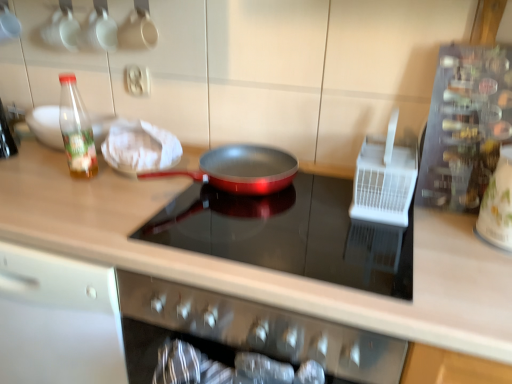
Image resolution: width=512 pixels, height=384 pixels. What do you see at coordinates (261, 268) in the screenshot?
I see `matte wood countertop at center` at bounding box center [261, 268].

Measure the distance between point (454, 264) and camera.

Point (454, 264) and camera are 34.57 inches apart from each other.

Identify the location of metallic silver spice rack at right, which ranks as the 2th appliance in right-to-left order. (465, 126).

At what (x,y) coordinates should I click in order to perform the action: click on transparent plastic bottle at left. Please return your answer as a coordinate pair (x, y). The height and width of the screenshot is (384, 512). Looking at the image, I should click on (76, 130).

Locate an element on the screen. countertop in front of the white glossy jar at right, arranged as the first appliance when viewed from the right is located at coordinates (261, 268).

Is matte wood countertop at center placed right next to white glossy jar at right, the 3th appliance positioned from the left?

No, matte wood countertop at center is not beside white glossy jar at right, the 3th appliance positioned from the left.

Is matte wood countertop at center turned away from white glossy jar at right, arranged as the first appliance when viewed from the right?

matte wood countertop at center does not have its back to white glossy jar at right, arranged as the first appliance when viewed from the right.

Based on the photo, is matte wood countertop at center far away from white cloth at upper left?

matte wood countertop at center is actually quite close to white cloth at upper left.

Considering the sizes of objects matte wood countertop at center and white cloth at upper left in the image provided, who is taller, matte wood countertop at center or white cloth at upper left?

Standing taller between the two is matte wood countertop at center.

Locate an element on the screen. Image resolution: width=512 pixels, height=384 pixels. food behind the matte wood countertop at center is located at coordinates (140, 147).

Which object is wider, matte wood countertop at center or white cloth at upper left?

With larger width is matte wood countertop at center.

Looking at their sizes, would you say metallic red frying pan at center is wider or thinner than metallic silver spice rack at right, which ranks as the 2th appliance in right-to-left order?

Considering their sizes, metallic red frying pan at center looks broader than metallic silver spice rack at right, which ranks as the 2th appliance in right-to-left order.

Can you confirm if metallic red frying pan at center is taller than metallic silver spice rack at right, which ranks as the 2th appliance in right-to-left order?

In fact, metallic red frying pan at center may be shorter than metallic silver spice rack at right, which ranks as the 2th appliance in right-to-left order.

From a real-world perspective, relative to metallic silver spice rack at right, which ranks as the 2th appliance in right-to-left order, is metallic red frying pan at center vertically above or below?

Clearly, from a real-world perspective, metallic red frying pan at center is below metallic silver spice rack at right, which ranks as the 2th appliance in right-to-left order.

Measure the distance from white plastic utensil holder at right, which is the 1th appliance from left to right, to matte wood countertop at center.

white plastic utensil holder at right, which is the 1th appliance from left to right, and matte wood countertop at center are 12.86 inches apart from each other.

Would you say matte wood countertop at center is part of white plastic utensil holder at right, which ranks as the third appliance in right-to-left order,'s contents?

Actually, matte wood countertop at center is outside white plastic utensil holder at right, which ranks as the third appliance in right-to-left order.

Is white plastic utensil holder at right, which ranks as the third appliance in right-to-left order, far away from matte wood countertop at center?

No, white plastic utensil holder at right, which ranks as the third appliance in right-to-left order, is not far from matte wood countertop at center.

From the image's perspective, which appliance is the 2nd one above the matte wood countertop at center? Please provide its 2D coordinates.

[(384, 179)]

Does metallic silver spice rack at right, placed as the second appliance when sorted from left to right, have a smaller size compared to white plastic utensil holder at right, which ranks as the third appliance in right-to-left order?

Actually, metallic silver spice rack at right, placed as the second appliance when sorted from left to right, might be larger than white plastic utensil holder at right, which ranks as the third appliance in right-to-left order.

From the image's perspective, between metallic silver spice rack at right, placed as the second appliance when sorted from left to right, and white plastic utensil holder at right, which ranks as the third appliance in right-to-left order, which one is located above?

metallic silver spice rack at right, placed as the second appliance when sorted from left to right, appears higher in the image.

How many degrees apart are the facing directions of metallic silver spice rack at right, which ranks as the 2th appliance in right-to-left order, and white plastic utensil holder at right, which ranks as the third appliance in right-to-left order?

There is a 0.254-degree angle between the facing directions of metallic silver spice rack at right, which ranks as the 2th appliance in right-to-left order, and white plastic utensil holder at right, which ranks as the third appliance in right-to-left order.

Which appliance is the 1st one when counting from the right side of the white plastic utensil holder at right, which ranks as the third appliance in right-to-left order? Please provide its 2D coordinates.

[(465, 126)]

What's the angular difference between white glossy jar at right, the 3th appliance positioned from the left, and white plastic utensil holder at right, which is the 1th appliance from left to right,'s facing directions?

The angle between the facing direction of white glossy jar at right, the 3th appliance positioned from the left, and the facing direction of white plastic utensil holder at right, which is the 1th appliance from left to right, is 1.7 degrees.

Between white glossy jar at right, the 3th appliance positioned from the left, and white plastic utensil holder at right, which is the 1th appliance from left to right, which one has larger size?

With larger size is white plastic utensil holder at right, which is the 1th appliance from left to right.

Which is behind, point (504, 240) or point (385, 156)?

Positioned behind is point (385, 156).

From a real-world perspective, which is physically below, white glossy jar at right, the 3th appliance positioned from the left, or white plastic utensil holder at right, which is the 1th appliance from left to right?

From a 3D spatial view, white glossy jar at right, the 3th appliance positioned from the left, is below.

In the scene shown: Does metallic silver spice rack at right, placed as the second appliance when sorted from left to right, have a lesser width compared to matte wood countertop at center?

Yes.

Does metallic silver spice rack at right, placed as the second appliance when sorted from left to right, appear on the left side of matte wood countertop at center?

In fact, metallic silver spice rack at right, placed as the second appliance when sorted from left to right, is to the right of matte wood countertop at center.

From a real-world perspective, is metallic silver spice rack at right, which ranks as the 2th appliance in right-to-left order, over matte wood countertop at center?

Yes, from a real-world perspective, metallic silver spice rack at right, which ranks as the 2th appliance in right-to-left order, is above matte wood countertop at center.

Starting from the matte wood countertop at center, which appliance is the 3rd one to the right? Please provide its 2D coordinates.

[(498, 204)]

You are a GUI agent. You are given a task and a screenshot of the screen. Output one action in this format:
    pyautogui.click(x=<x>, y=<y>)
    Task: Click on the food located on the left of matte wood countertop at center
    The image size is (512, 384).
    Given the screenshot: What is the action you would take?
    pyautogui.click(x=140, y=147)

From the image, which object appears to be farther from white glossy jar at right, the 3th appliance positioned from the left, transparent plastic bottle at left or metallic silver spice rack at right, placed as the second appliance when sorted from left to right?

Based on the image, transparent plastic bottle at left appears to be further to white glossy jar at right, the 3th appliance positioned from the left.

From the image, which object appears to be farther from matte wood countertop at center, white cloth at upper left or metallic silver spice rack at right, placed as the second appliance when sorted from left to right?

metallic silver spice rack at right, placed as the second appliance when sorted from left to right.

Looking at the image, which one is located further to white plastic utensil holder at right, which is the 1th appliance from left to right, metallic red frying pan at center or white glossy jar at right, the 3th appliance positioned from the left?

Among the two, white glossy jar at right, the 3th appliance positioned from the left, is located further to white plastic utensil holder at right, which is the 1th appliance from left to right.

Based on the photo, based on their spatial positions, is white cloth at upper left or white glossy jar at right, arranged as the first appliance when viewed from the right, further from metallic silver spice rack at right, which ranks as the 2th appliance in right-to-left order?

The object further to metallic silver spice rack at right, which ranks as the 2th appliance in right-to-left order, is white cloth at upper left.

Looking at the image, which one is located further to white plastic utensil holder at right, which ranks as the third appliance in right-to-left order, transparent plastic bottle at left or metallic red frying pan at center?

Based on the image, transparent plastic bottle at left appears to be further to white plastic utensil holder at right, which ranks as the third appliance in right-to-left order.

Estimate the real-world distances between objects in this image. Which object is further from transparent plastic bottle at left, white glossy jar at right, the 3th appliance positioned from the left, or matte wood countertop at center?

white glossy jar at right, the 3th appliance positioned from the left, lies further to transparent plastic bottle at left than the other object.

When comparing their distances from transparent plastic bottle at left, does metallic silver spice rack at right, which ranks as the 2th appliance in right-to-left order, or metallic red frying pan at center seem further?

metallic silver spice rack at right, which ranks as the 2th appliance in right-to-left order.

From the picture: Based on their spatial positions, is matte wood countertop at center or white plastic utensil holder at right, which is the 1th appliance from left to right, further from white cloth at upper left?

Among the two, white plastic utensil holder at right, which is the 1th appliance from left to right, is located further to white cloth at upper left.

The image size is (512, 384). I want to click on food between transparent plastic bottle at left and metallic red frying pan at center, so click(140, 147).

Locate an element on the screen. The image size is (512, 384). gas stove located between matte wood countertop at center and white glossy jar at right, the 3th appliance positioned from the left, in the left-right direction is located at coordinates 289,234.

Find the location of a particular element. appliance situated between white plastic utensil holder at right, which is the 1th appliance from left to right, and white glossy jar at right, the 3th appliance positioned from the left, from left to right is located at coordinates (465, 126).

Where is `gas stove between transparent plastic bottle at left and metallic silver spice rack at right, placed as the second appliance when sorted from left to right, from left to right`? This screenshot has height=384, width=512. gas stove between transparent plastic bottle at left and metallic silver spice rack at right, placed as the second appliance when sorted from left to right, from left to right is located at coordinates pyautogui.click(x=289, y=234).